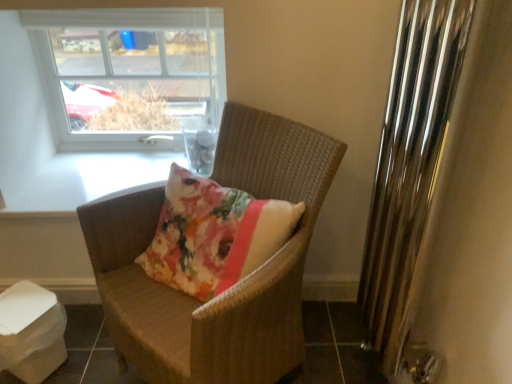
Question: Is woven brown chair at center thinner than polished chrome radiator at right?

Choices:
 (A) yes
 (B) no

Answer: (B)

Question: Can you confirm if woven brown chair at center is positioned to the left of polished chrome radiator at right?

Choices:
 (A) yes
 (B) no

Answer: (A)

Question: Is polished chrome radiator at right located within woven brown chair at center?

Choices:
 (A) yes
 (B) no

Answer: (B)

Question: Is woven brown chair at center taller than polished chrome radiator at right?

Choices:
 (A) no
 (B) yes

Answer: (A)

Question: From the image's perspective, does woven brown chair at center appear higher than polished chrome radiator at right?

Choices:
 (A) yes
 (B) no

Answer: (B)

Question: From a real-world perspective, is woven brown chair at center positioned above or below polished chrome radiator at right?

Choices:
 (A) above
 (B) below

Answer: (B)

Question: Is point (238, 180) closer or farther from the camera than point (387, 261)?

Choices:
 (A) closer
 (B) farther

Answer: (B)

Question: From the image's perspective, is woven brown chair at center located above or below polished chrome radiator at right?

Choices:
 (A) below
 (B) above

Answer: (A)

Question: Considering the positions of woven brown chair at center and polished chrome radiator at right in the image, is woven brown chair at center bigger or smaller than polished chrome radiator at right?

Choices:
 (A) big
 (B) small

Answer: (A)

Question: In the image, is clear glass window at upper left positioned in front of or behind woven brown chair at center?

Choices:
 (A) behind
 (B) front

Answer: (A)

Question: Visually, is clear glass window at upper left positioned to the left or to the right of woven brown chair at center?

Choices:
 (A) left
 (B) right

Answer: (A)

Question: In terms of size, does clear glass window at upper left appear bigger or smaller than woven brown chair at center?

Choices:
 (A) small
 (B) big

Answer: (A)

Question: Is clear glass window at upper left taller or shorter than woven brown chair at center?

Choices:
 (A) tall
 (B) short

Answer: (B)

Question: Is point (275, 364) positioned closer to the camera than point (155, 140)?

Choices:
 (A) closer
 (B) farther

Answer: (A)

Question: From the image's perspective, is woven brown chair at center positioned above or below clear glass window at upper left?

Choices:
 (A) below
 (B) above

Answer: (A)